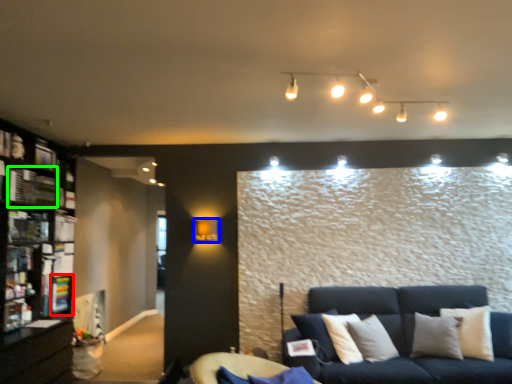
Question: Which object is positioned closest to shelf (highlighted by a red box)? Select from lamp (highlighted by a blue box) and shelf (highlighted by a green box).

Choices:
 (A) lamp
 (B) shelf

Answer: (B)